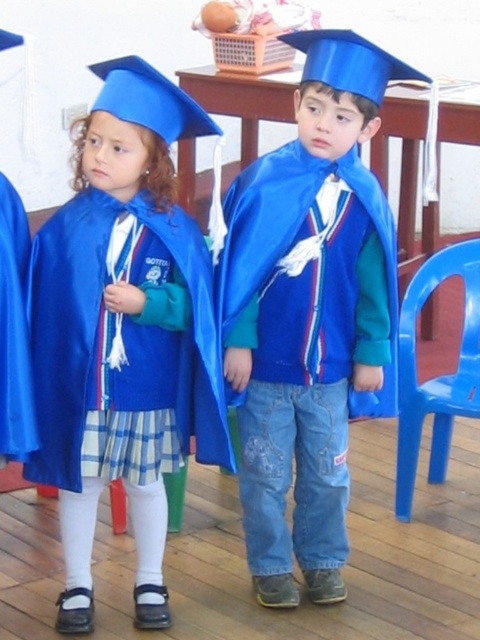
In the scene shown: You are a photographer trying to capture a clear photo of the matte blue graduation gown at center without the blue plastic chair at lower right appearing in the background. Based on their positions, is this possible?

The matte blue graduation gown at center is in front of the blue plastic chair at lower right, so it is possible to take a photo where the gown is the main subject and the chair is not visible in the background.

You are a photographer trying to capture both the shiny blue graduation gown at center and the matte blue graduation gown at center in a single frame. Given that the shiny one is larger, which gown should you focus on to ensure both are visible without cropping?

To ensure both the shiny blue graduation gown at center and the matte blue graduation gown at center are visible without cropping, focus on the matte blue graduation gown at center since it is smaller in size and the larger shiny one will naturally take up more space, allowing both to fit within the frame.

You are a photographer taking a picture of the shiny blue graduation gown at center and the matte blue graduation gown at center. Which one is located to the right of the other?

The shiny blue graduation gown at center is positioned on the right side of matte blue graduation gown at center.